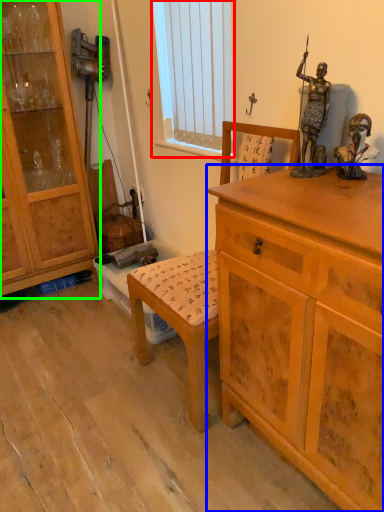
Question: Estimate the real-world distances between objects in this image. Which object is closer to window screen (highlighted by a red box), chest of drawers (highlighted by a blue box) or cabinetry (highlighted by a green box)?

Choices:
 (A) chest of drawers
 (B) cabinetry

Answer: (B)